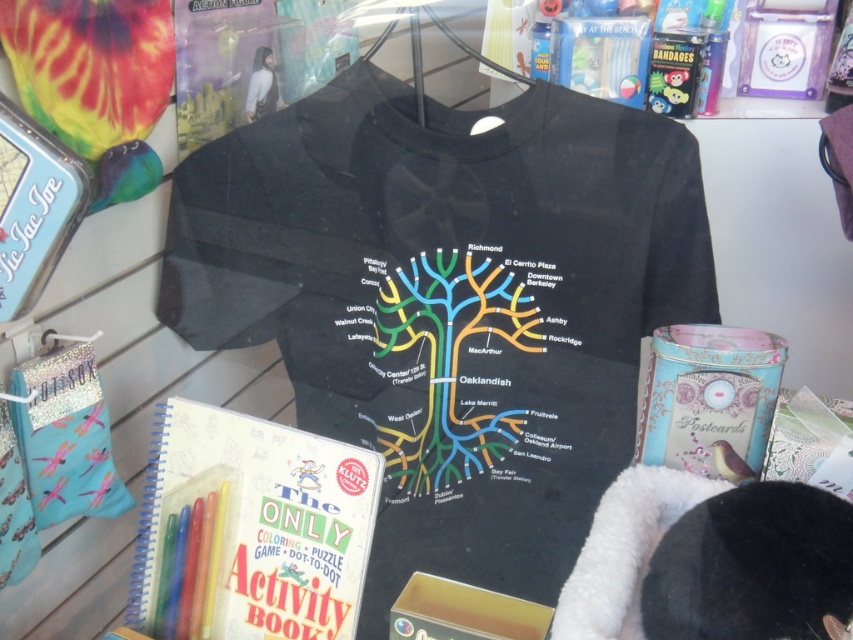
Question: Observing the image, what is the correct spatial positioning of multicolored map at center in reference to gold cardboard box at lower center?

Choices:
 (A) right
 (B) left

Answer: (B)

Question: Is matte paper activity book at center in front of multicolored map at center?

Choices:
 (A) yes
 (B) no

Answer: (A)

Question: Considering the real-world distances, which object is closest to the multicolored map at center?

Choices:
 (A) matte paper activity book at center
 (B) gold cardboard box at lower center

Answer: (A)

Question: Which object is positioned closest to the gold cardboard box at lower center?

Choices:
 (A) multicolored map at center
 (B) matte paper activity book at center

Answer: (B)

Question: Can you confirm if multicolored map at center is smaller than gold cardboard box at lower center?

Choices:
 (A) no
 (B) yes

Answer: (A)

Question: Which point is closer to the camera?

Choices:
 (A) matte paper activity book at center
 (B) gold cardboard box at lower center
 (C) multicolored map at center

Answer: (B)